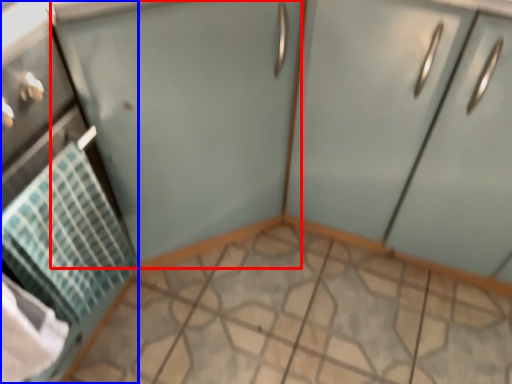
Question: Among these objects, which one is nearest to the camera, screen door (highlighted by a red box) or appliance (highlighted by a blue box)?

Choices:
 (A) screen door
 (B) appliance

Answer: (B)